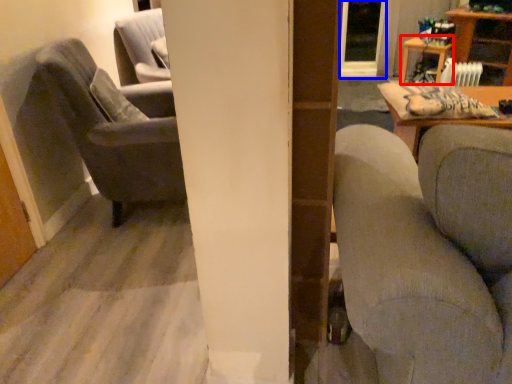
Question: Among these objects, which one is nearest to the camera, table (highlighted by a red box) or glass door (highlighted by a blue box)?

Choices:
 (A) table
 (B) glass door

Answer: (A)